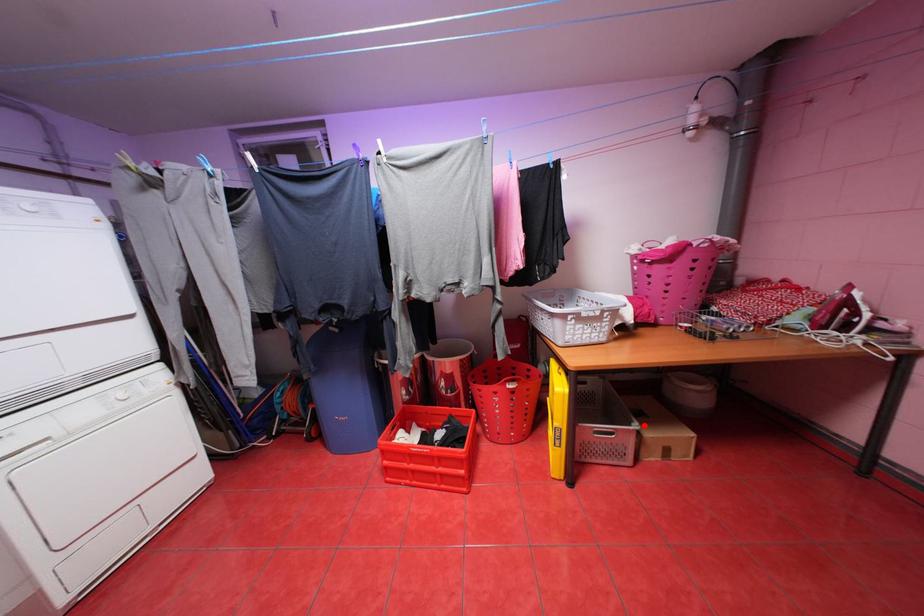
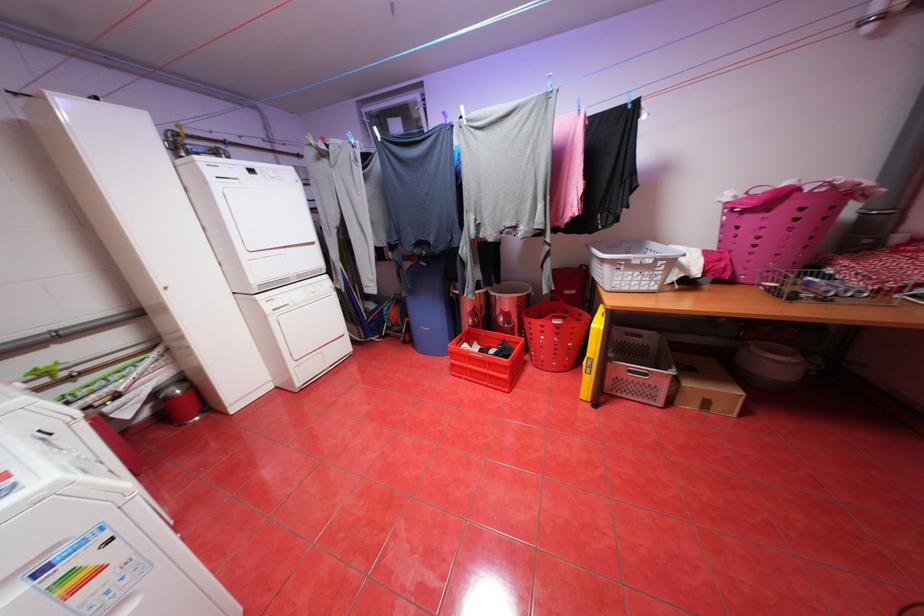
In the second image, find the point that corresponds to the highlighted location in the first image.

(681, 371)